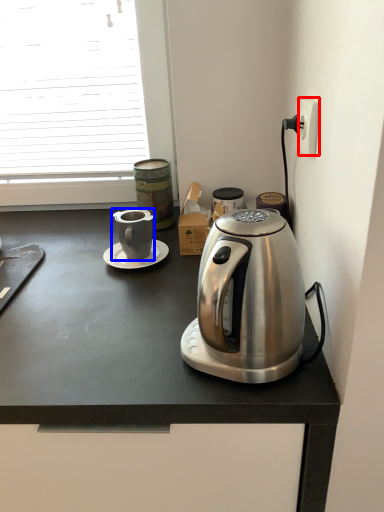
Question: Which of the following is the closest to the observer, power outlet (highlighted by a red box) or coffee cup (highlighted by a blue box)?

Choices:
 (A) power outlet
 (B) coffee cup

Answer: (A)